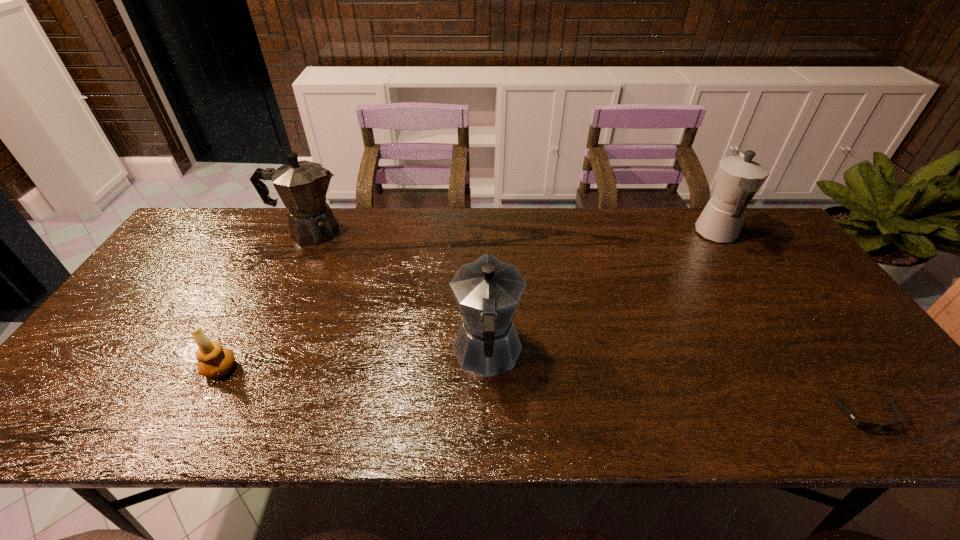
The image size is (960, 540). I want to click on vacant region that satisfies the following two spatial constraints: 1. at the spout of the nearest coffeepot; 2. on the pouring side of the leftmost coffeepot, so click(x=486, y=232).